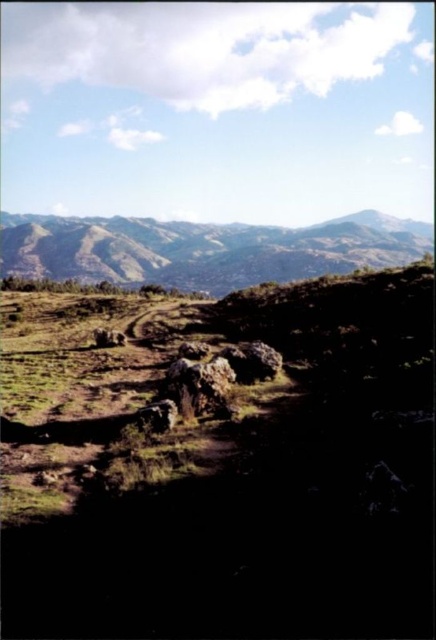
Question: Is rough textured rock at center to the right of rusty metallic rock at center from the viewer's perspective?

Choices:
 (A) yes
 (B) no

Answer: (A)

Question: Does green grassy hillside at lower left appear on the left side of rusty metallic rock at center?

Choices:
 (A) yes
 (B) no

Answer: (A)

Question: Which object is the closest to the rugged brown mountain at upper center?

Choices:
 (A) green grassy hillside at lower left
 (B) rusty metallic rock at center
 (C) rough textured rock at center

Answer: (A)

Question: Can you confirm if rough textured rock at center is positioned to the left of rusty metallic rock at center?

Choices:
 (A) no
 (B) yes

Answer: (A)

Question: Estimate the real-world distances between objects in this image. Which object is closer to the rough textured rock at center?

Choices:
 (A) rusty metallic rock at center
 (B) rugged brown mountain at upper center
 (C) green grassy hillside at lower left

Answer: (A)

Question: Which point is farther to the camera?

Choices:
 (A) rusty metallic rock at center
 (B) rugged brown mountain at upper center
 (C) green grassy hillside at lower left
 (D) rough textured rock at center

Answer: (B)